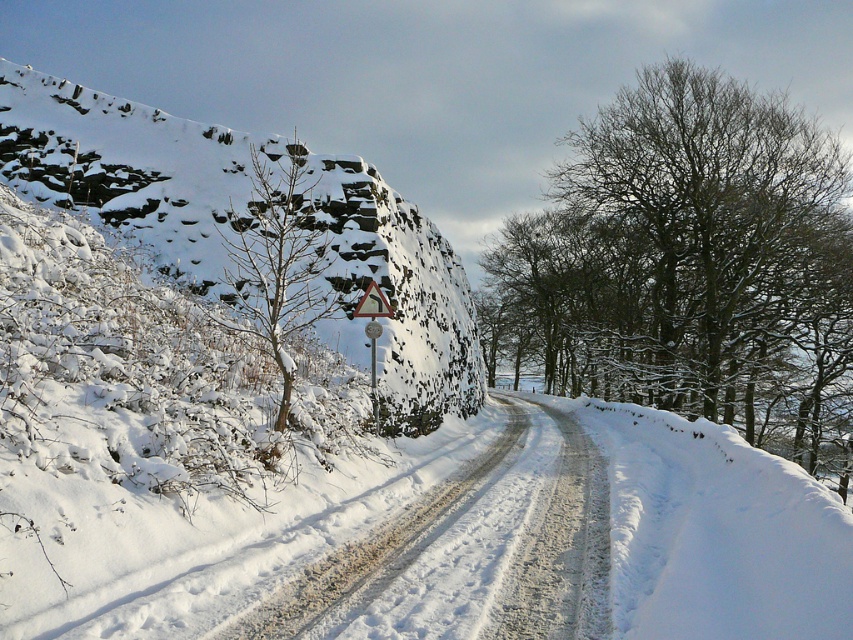
You are standing on the snow road and see a point marked at coordinates [248,216]. Based on the scene description, what does this point likely represent?

The point at coordinates [248,216] corresponds to the rocky snow covered hillside at upper left.